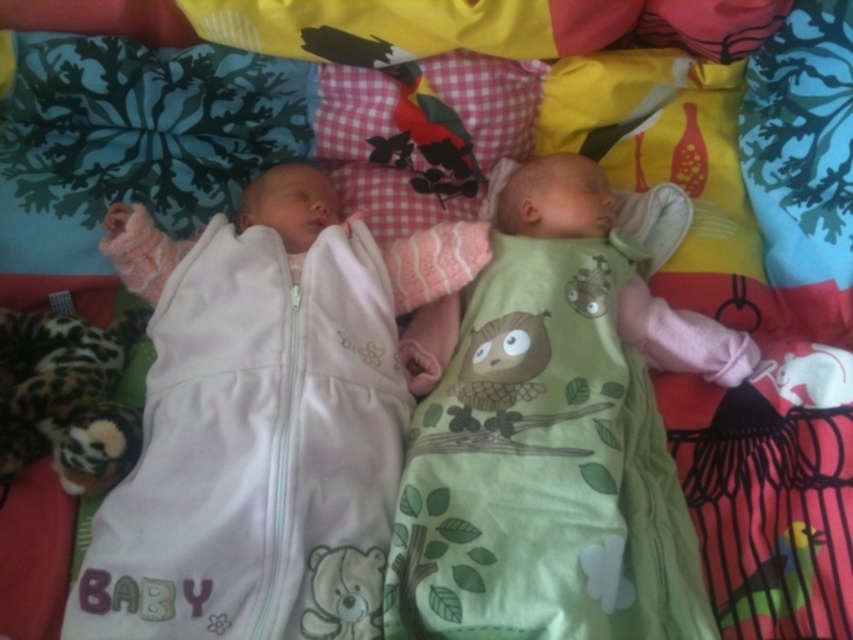
Question: Is green soft baby at center wider than white soft baby sleeping bag at left?

Choices:
 (A) no
 (B) yes

Answer: (B)

Question: Which object appears closest to the camera in this image?

Choices:
 (A) white soft baby sleeping bag at left
 (B) green soft baby at center

Answer: (A)

Question: Which point appears farthest from the camera in this image?

Choices:
 (A) (590, 336)
 (B) (370, 554)

Answer: (A)

Question: Does green soft baby at center have a lesser width compared to white soft baby sleeping bag at left?

Choices:
 (A) no
 (B) yes

Answer: (A)

Question: Is green soft baby at center below white soft baby sleeping bag at left?

Choices:
 (A) no
 (B) yes

Answer: (A)